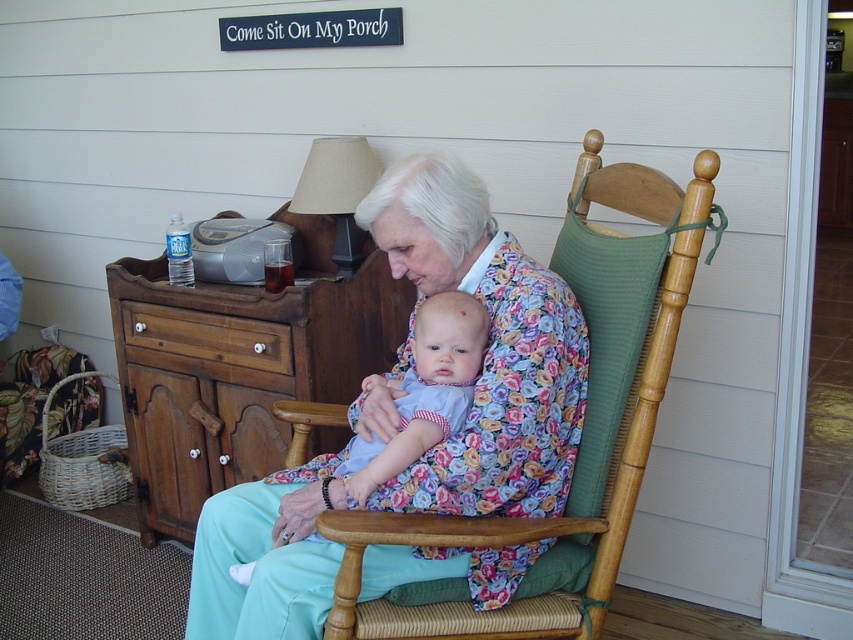
Can you confirm if light blue fabric dress at center is positioned below light blue fabric baby at center?

Yes, light blue fabric dress at center is below light blue fabric baby at center.

Who is taller, light blue fabric dress at center or light blue fabric baby at center?

light blue fabric dress at center is taller.

The width and height of the screenshot is (853, 640). Identify the location of light blue fabric dress at center. (422, 392).

Between woven wood armchair at center and light blue fabric dress at center, which one is positioned lower?

Positioned lower is light blue fabric dress at center.

Does woven wood armchair at center have a smaller size compared to light blue fabric dress at center?

No, woven wood armchair at center is not smaller than light blue fabric dress at center.

Find the location of a particular element. Image resolution: width=853 pixels, height=640 pixels. woven wood armchair at center is located at coordinates (583, 429).

Based on the photo, can you confirm if floral fabric dress at center is positioned to the right of woven wood armchair at center?

In fact, floral fabric dress at center is to the left of woven wood armchair at center.

Find the location of a particular element. Image resolution: width=853 pixels, height=640 pixels. floral fabric dress at center is located at coordinates (488, 348).

Image resolution: width=853 pixels, height=640 pixels. In order to click on floral fabric dress at center in this screenshot , I will do `click(488, 348)`.